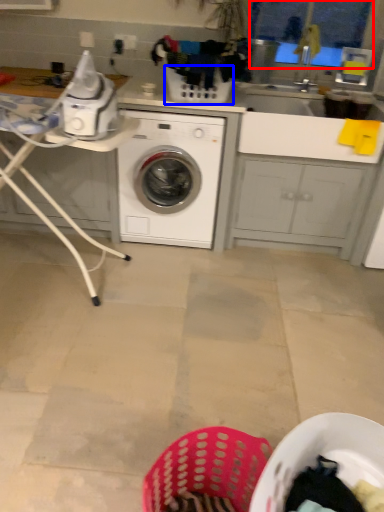
Question: Among these objects, which one is nearest to the camera, window screen (highlighted by a red box) or basket (highlighted by a blue box)?

Choices:
 (A) window screen
 (B) basket

Answer: (B)